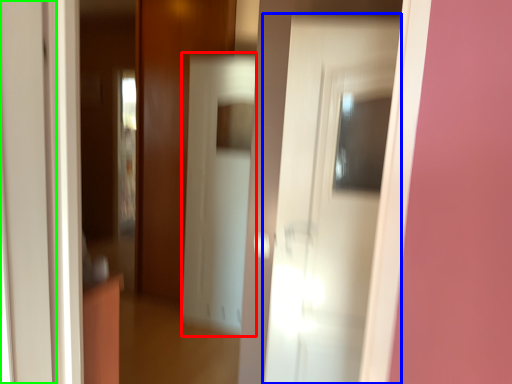
Question: Considering the real-world distances, which object is farthest from screen door (highlighted by a red box)? door (highlighted by a blue box) or door (highlighted by a green box)?

Choices:
 (A) door
 (B) door

Answer: (B)